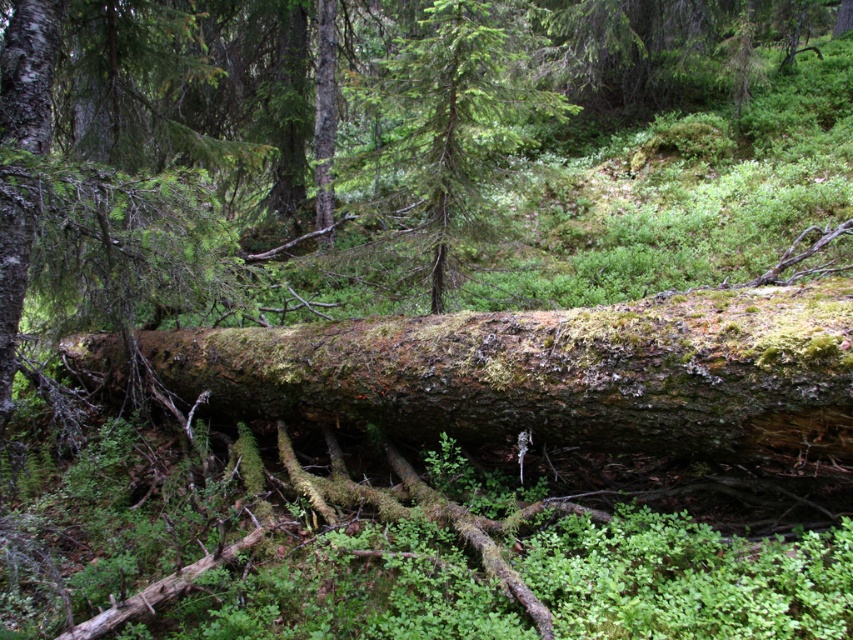
You are standing in the forest and see a mossy bark log at center. There is a point at coordinates (554, 372). Is this point located on the mossy bark log at center?

Yes, the point at coordinates (554, 372) is located on the mossy bark log at center.

Looking at this image, you are a hiker who wants to cross the forest floor. You notice the mossy bark log at center and the green rough bark tree at center. Which object is located to the left when facing towards the center of the scene?

The mossy bark log at center is positioned on the left side of green rough bark tree at center, so when facing towards the center of the scene, the mossy bark log at center is to the left of the green rough bark tree at center.

You are a hiker navigating through the forest and want to cross to the other side. There is a mossy bark log at center and a green rough bark tree at center in your path. Which object should you step over first?

You should step over the mossy bark log at center first because it is in front of the green rough bark tree at center.